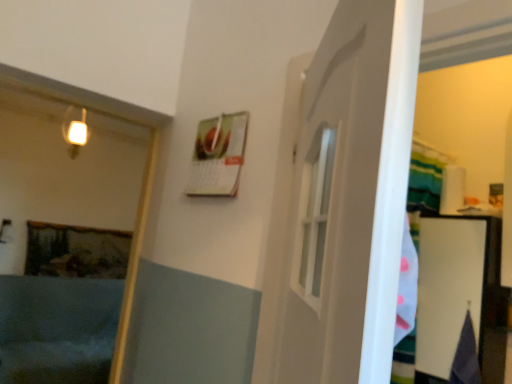
Question: Is point (86, 132) positioned closer to the camera than point (5, 342)?

Choices:
 (A) farther
 (B) closer

Answer: (B)

Question: From their relative heights in the image, would you say matte white light fixture at upper left is taller or shorter than matte blue bathtub at lower left?

Choices:
 (A) short
 (B) tall

Answer: (A)

Question: From the image's perspective, relative to matte blue bathtub at lower left, is matte white light fixture at upper left above or below?

Choices:
 (A) below
 (B) above

Answer: (B)

Question: From a real-world perspective, is matte blue bathtub at lower left positioned above or below matte white light fixture at upper left?

Choices:
 (A) below
 (B) above

Answer: (A)

Question: From the image's perspective, is matte blue bathtub at lower left above or below matte white light fixture at upper left?

Choices:
 (A) above
 (B) below

Answer: (B)

Question: In terms of width, does matte blue bathtub at lower left look wider or thinner when compared to matte white light fixture at upper left?

Choices:
 (A) thin
 (B) wide

Answer: (B)

Question: In terms of size, does matte blue bathtub at lower left appear bigger or smaller than matte white light fixture at upper left?

Choices:
 (A) small
 (B) big

Answer: (B)